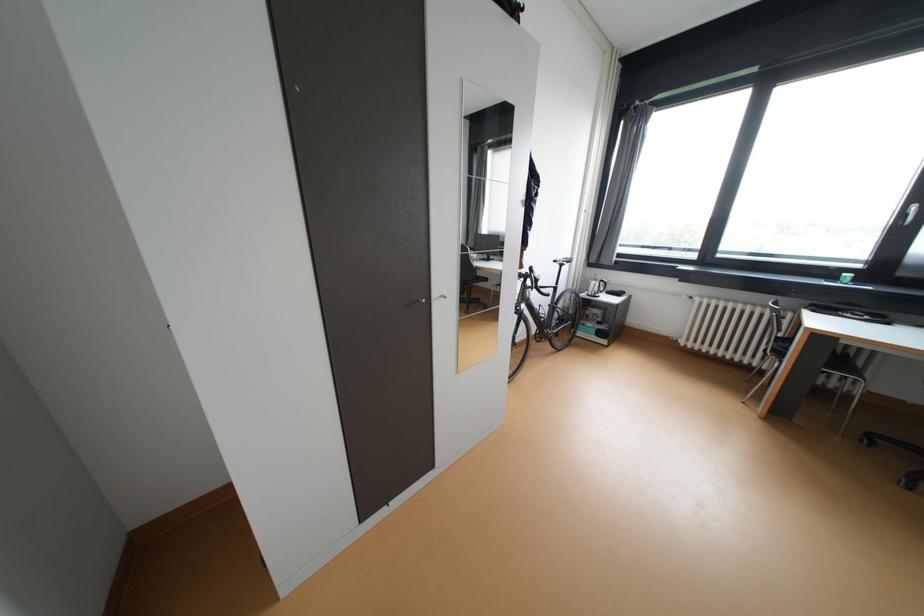
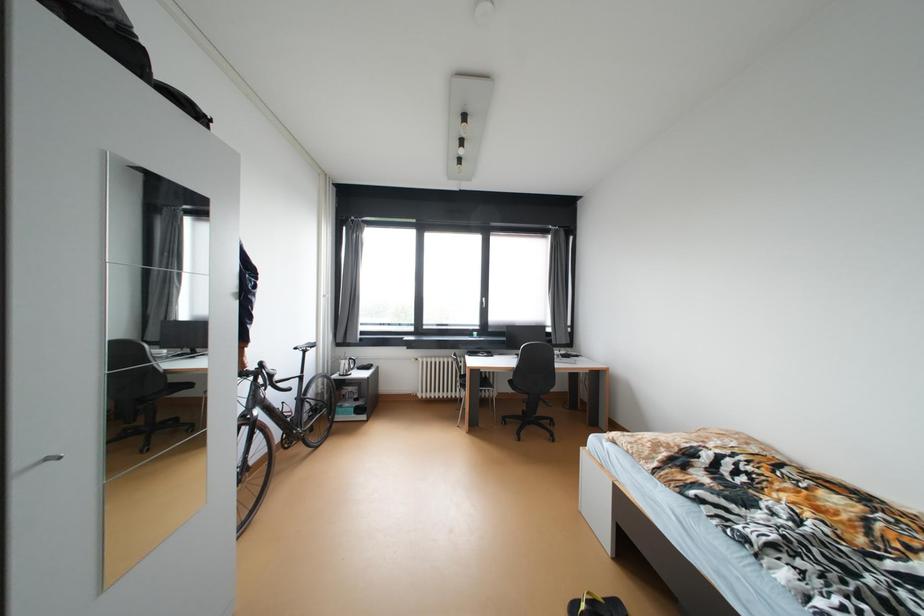
Question: The camera is either moving clockwise (left) or counter-clockwise (right) around the object. The first image is from the beginning of the video and the second image is from the end. Is the camera moving left or right when shooting the video?

Choices:
 (A) Left
 (B) Right

Answer: (A)